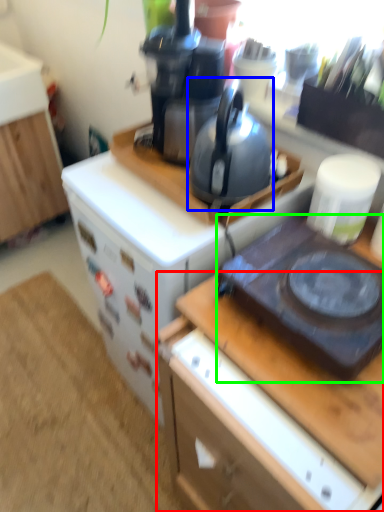
Question: Which object is positioned farthest from desk (highlighted by a red box)? Select from kettle (highlighted by a blue box) and gas stove (highlighted by a green box).

Choices:
 (A) kettle
 (B) gas stove

Answer: (A)